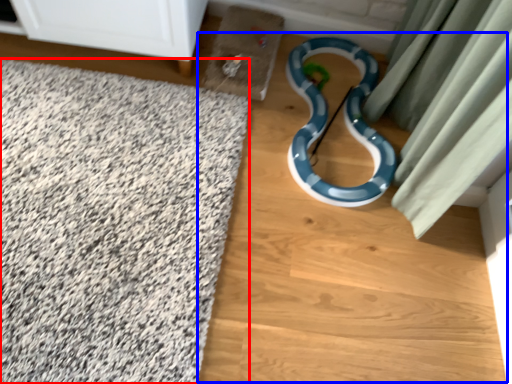
Question: Which object is closer to the camera taking this photo, bath mat (highlighted by a red box) or dirt track (highlighted by a blue box)?

Choices:
 (A) bath mat
 (B) dirt track

Answer: (A)